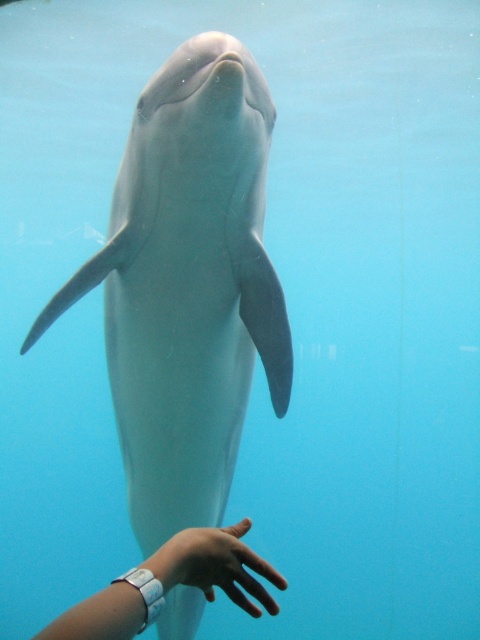
Question: Which of the following is the closest to the observer?

Choices:
 (A) white rubber watch at lower center
 (B) smooth skin hand at center
 (C) smooth gray dolphin at center

Answer: (A)

Question: Does white rubber watch at lower center lie behind smooth skin hand at center?

Choices:
 (A) yes
 (B) no

Answer: (B)

Question: Is white rubber watch at lower center to the right of smooth skin hand at center from the viewer's perspective?

Choices:
 (A) yes
 (B) no

Answer: (B)

Question: Which point is farther from the camera taking this photo?

Choices:
 (A) (287, 586)
 (B) (241, 556)
 (C) (254, 124)

Answer: (C)

Question: Does smooth gray dolphin at center appear on the right side of white rubber watch at lower center?

Choices:
 (A) yes
 (B) no

Answer: (B)

Question: Which point is closer to the camera?

Choices:
 (A) (144, 157)
 (B) (206, 579)
 (C) (117, 588)

Answer: (C)